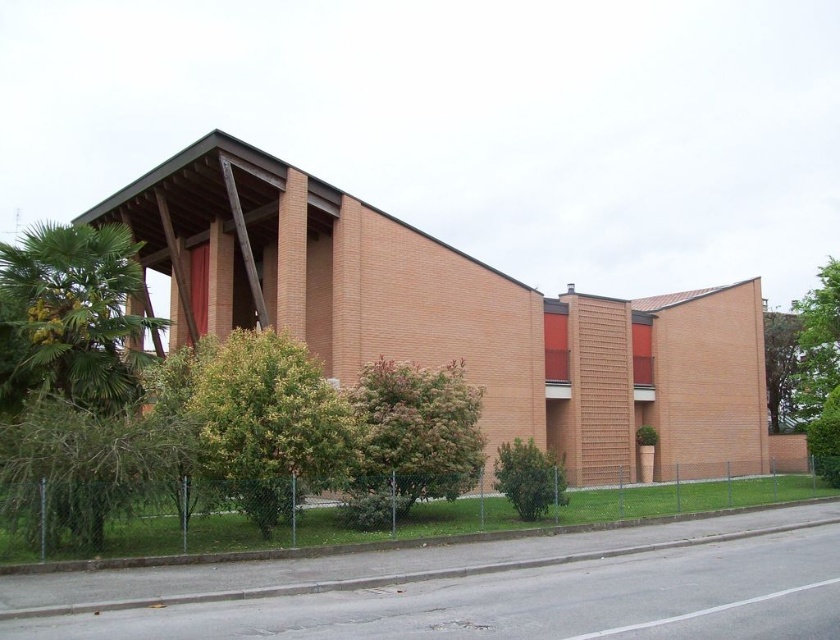
Does green leafy tree at center appear over green leafy tree at upper right?

No.

Who is taller, green leafy tree at center or green leafy tree at upper right?

Standing taller between the two is green leafy tree at upper right.

Is point (395, 467) less distant than point (768, 310)?

Yes, point (395, 467) is in front of point (768, 310).

The width and height of the screenshot is (840, 640). What are the coordinates of `green leafy tree at center` in the screenshot? It's located at (416, 432).

Between green leafy tree at left and green leafy tree at upper right, which one has less height?

green leafy tree at upper right

Which is in front, point (35, 394) or point (780, 321)?

Point (35, 394) is in front.

What are the coordinates of `green leafy tree at left` in the screenshot? It's located at (72, 371).

Who is positioned more to the right, green leafy bush at lower center or green leafy tree at upper right?

Positioned to the right is green leafy tree at upper right.

Is point (565, 486) positioned in front of point (790, 426)?

That is True.

Where is `green leafy bush at lower center`? green leafy bush at lower center is located at coordinates (528, 477).